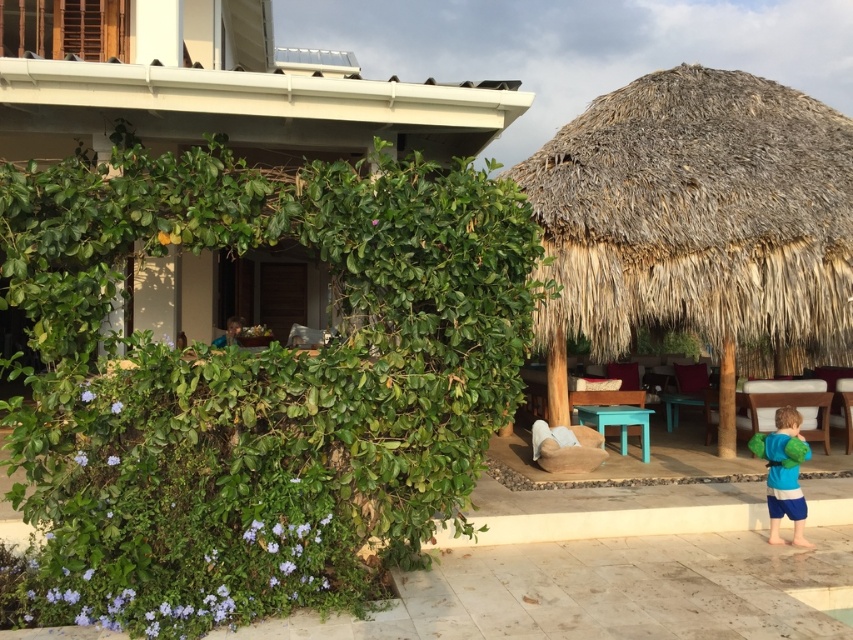
Question: Does thatched straw hut at right appear under blue fleece jacket at lower right?

Choices:
 (A) yes
 (B) no

Answer: (B)

Question: Does thatched straw hut at right have a larger size compared to blue fleece jacket at lower right?

Choices:
 (A) yes
 (B) no

Answer: (A)

Question: Which point appears farthest from the camera in this image?

Choices:
 (A) (809, 228)
 (B) (805, 451)

Answer: (A)

Question: Does thatched straw hut at right appear on the left side of blue fleece jacket at lower right?

Choices:
 (A) no
 (B) yes

Answer: (A)